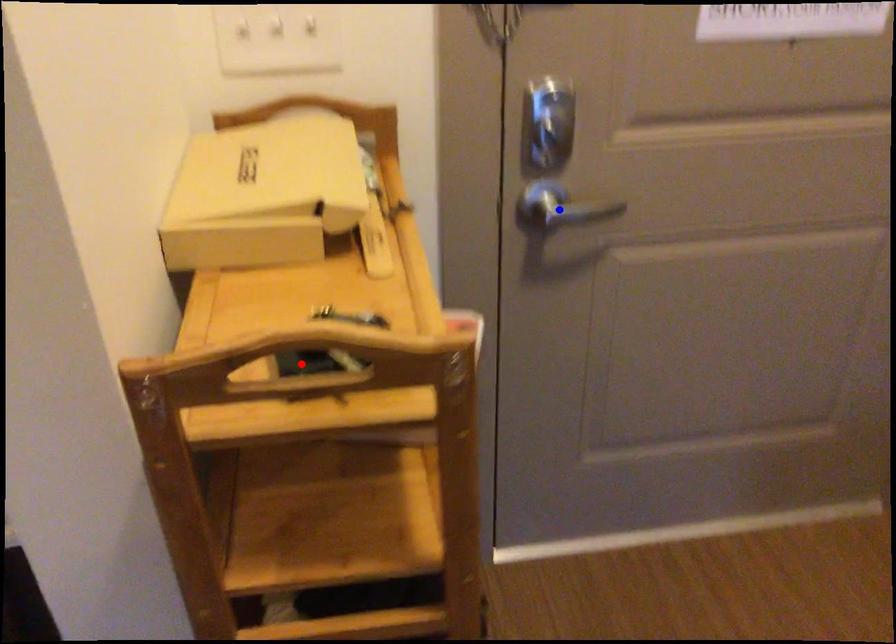
Question: Which of the two points in the image is closer to the camera?

Choices:
 (A) Blue point is closer.
 (B) Red point is closer.

Answer: (B)